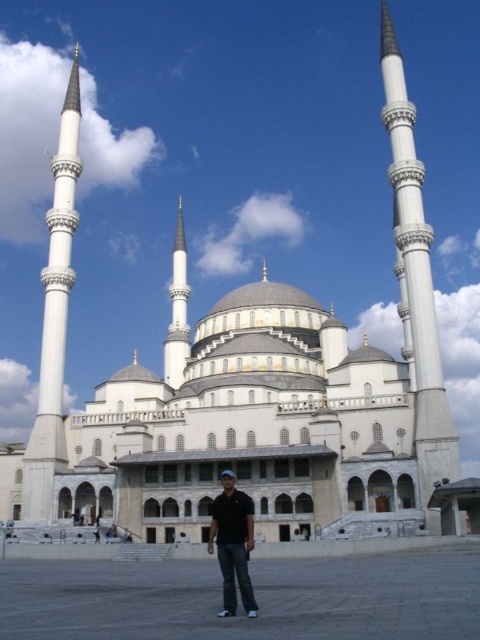
Question: Considering the relative positions of white marble minaret at right and white marble minaret at left in the image provided, where is white marble minaret at right located with respect to white marble minaret at left?

Choices:
 (A) right
 (B) left

Answer: (A)

Question: Is the position of white marble minaret at left more distant than that of black matte shirt at center?

Choices:
 (A) yes
 (B) no

Answer: (A)

Question: Which of these objects is positioned closest to the black matte shirt at center?

Choices:
 (A) white marble minaret at left
 (B) white marble minaret at right

Answer: (B)

Question: Which of the following is the closest to the observer?

Choices:
 (A) (232, 588)
 (B) (395, 147)

Answer: (A)

Question: Is white marble minaret at right below black matte shirt at center?

Choices:
 (A) yes
 (B) no

Answer: (B)

Question: Which of the following is the closest to the observer?

Choices:
 (A) (224, 522)
 (B) (434, 461)
 (C) (70, 273)

Answer: (A)